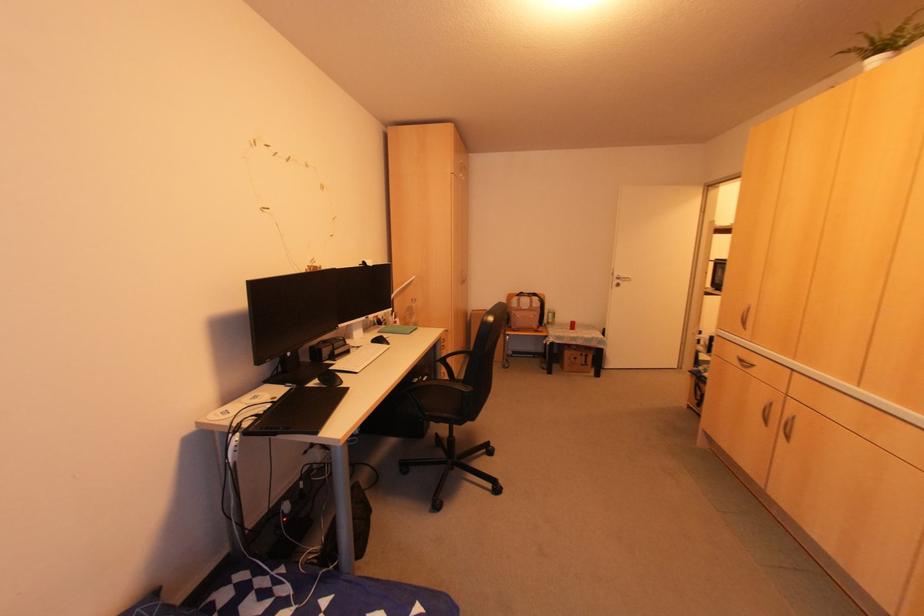
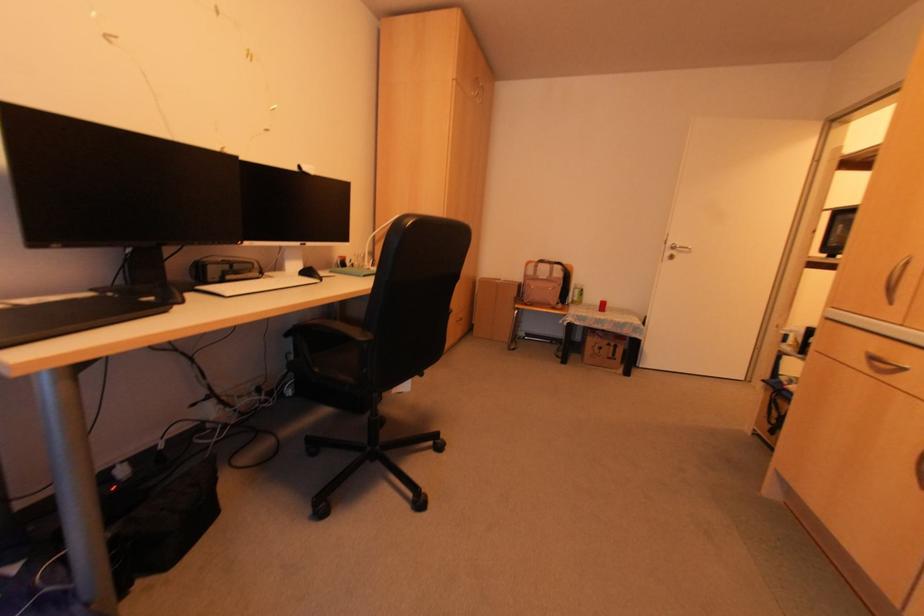
In the second image, find the point that corresponds to the point at 570,326 in the first image.

(601, 307)